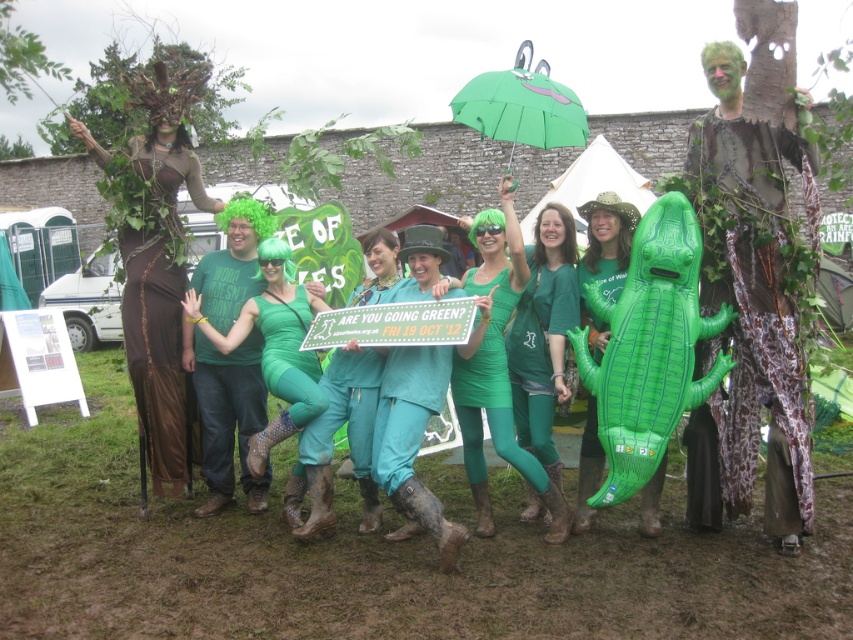
You are a photographer at the event and need to arrange the brown textured dress at left and the green matte dress at center for a photo. If you want to place them side by side so that the smaller dress is on the right, which dress should be on the left?

The brown textured dress at left is bigger than the green matte dress at center, so the smaller green matte dress at center should be placed on the right, making the brown textured dress at left on the left side.